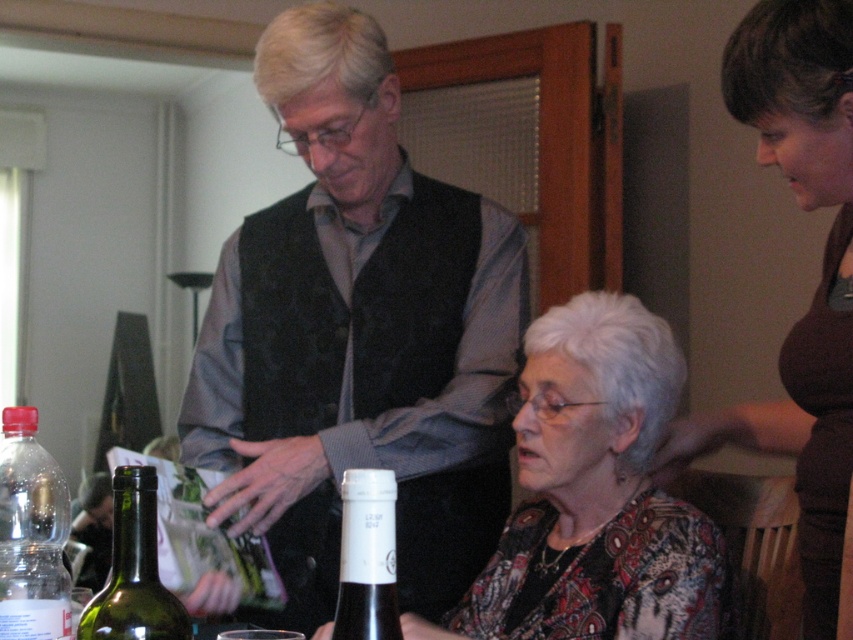
Does point (665, 528) come behind point (141, 573)?

Yes, it is behind point (141, 573).

Who is positioned more to the right, patterned fabric blouse at center or green glass bottle at lower left?

From the viewer's perspective, patterned fabric blouse at center appears more on the right side.

Measure the distance between patterned fabric blouse at center and camera.

patterned fabric blouse at center and camera are 4.35 feet apart from each other.

Where is `patterned fabric blouse at center`? patterned fabric blouse at center is located at coordinates (595, 493).

Is point (523, 621) less distant than point (335, 625)?

No, (523, 621) is further to viewer.

Does patterned fabric blouse at center appear over black glass wine bottle at lower center?

Actually, patterned fabric blouse at center is below black glass wine bottle at lower center.

Where is `patterned fabric blouse at center`? The height and width of the screenshot is (640, 853). patterned fabric blouse at center is located at coordinates (595, 493).

Who is positioned more to the right, brown fabric shirt at upper right or transparent plastic bottle at lower left?

brown fabric shirt at upper right is more to the right.

Who is more distant from viewer, (840, 492) or (19, 586)?

Point (840, 492)

I want to click on brown fabric shirt at upper right, so click(x=817, y=285).